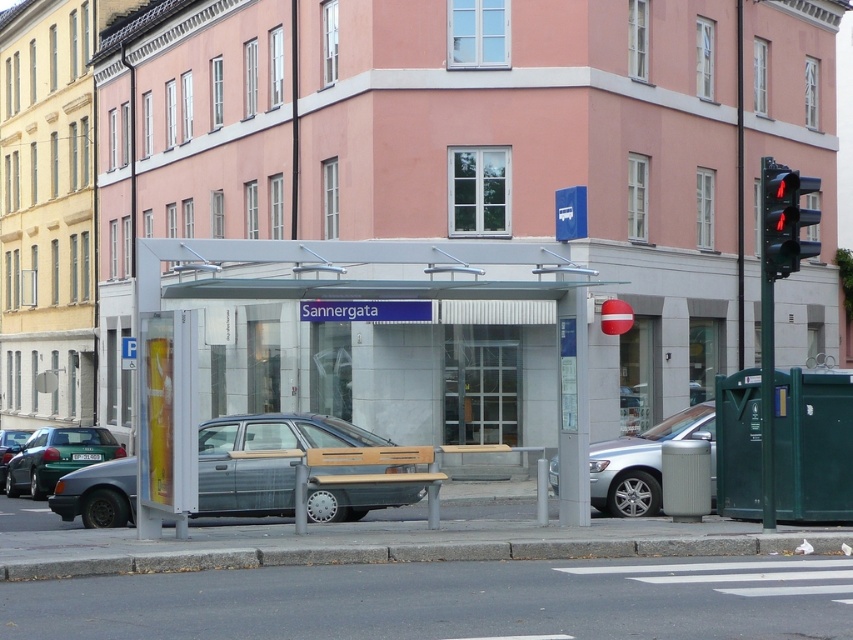
Between green plastic phone box at lower right and silver metallic car at center, which one has more height?

Standing taller between the two is green plastic phone box at lower right.

Which is in front, point (734, 388) or point (601, 481)?

Point (734, 388)

Where is `green plastic phone box at lower right`? green plastic phone box at lower right is located at coordinates (811, 444).

How distant is metallic gray car at center from matte gray sedan at lower left?

A distance of 49.24 feet exists between metallic gray car at center and matte gray sedan at lower left.

Does metallic gray car at center have a lesser width compared to matte gray sedan at lower left?

In fact, metallic gray car at center might be wider than matte gray sedan at lower left.

I want to click on metallic gray car at center, so click(x=263, y=460).

From the picture: Who is shorter, black glass traffic light at upper right or matte gray sedan at lower left?

Standing shorter between the two is matte gray sedan at lower left.

How far apart are black glass traffic light at upper right and matte gray sedan at lower left?

The distance of black glass traffic light at upper right from matte gray sedan at lower left is 17.78 meters.

Does point (785, 273) lie in front of point (15, 429)?

Yes, point (785, 273) is in front of point (15, 429).

The image size is (853, 640). Find the location of `black glass traffic light at upper right`. black glass traffic light at upper right is located at coordinates (785, 218).